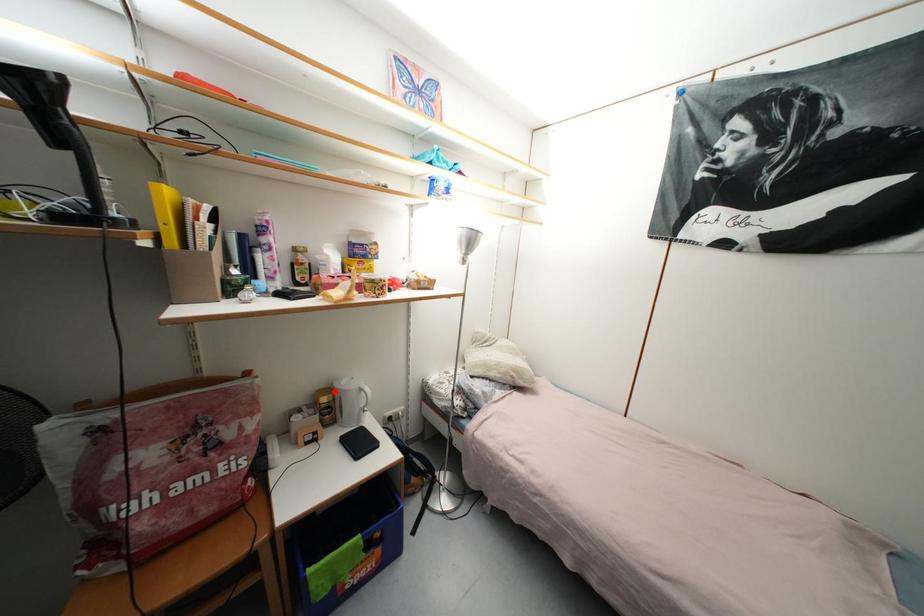
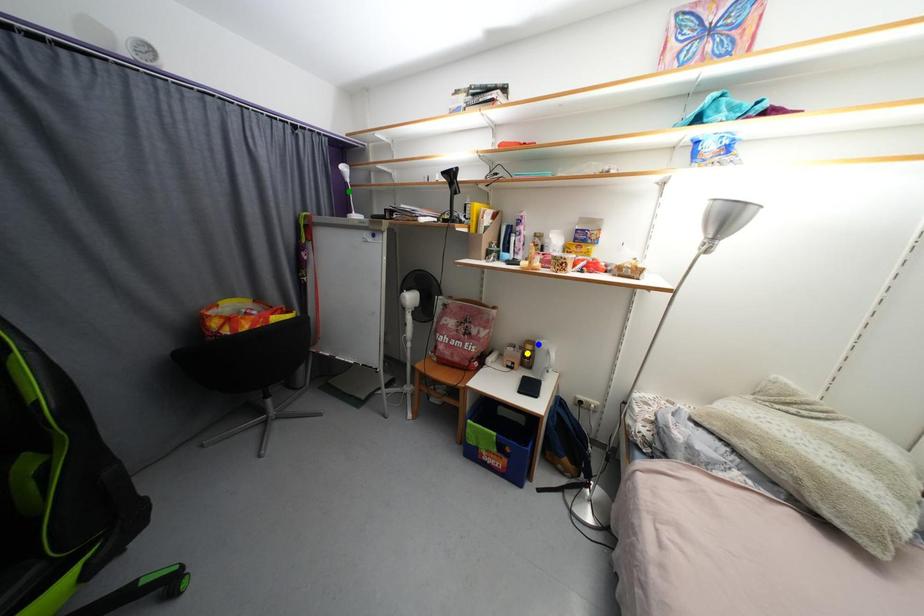
Question: I am providing you with two images of the same scene from different viewpoints. A red point is marked on the first image. You are given multiple points on the second image. Which point in image 2 represents the same 3d spot as the red point in image 1?

Choices:
 (A) yellow point
 (B) blue point
 (C) green point

Answer: (B)